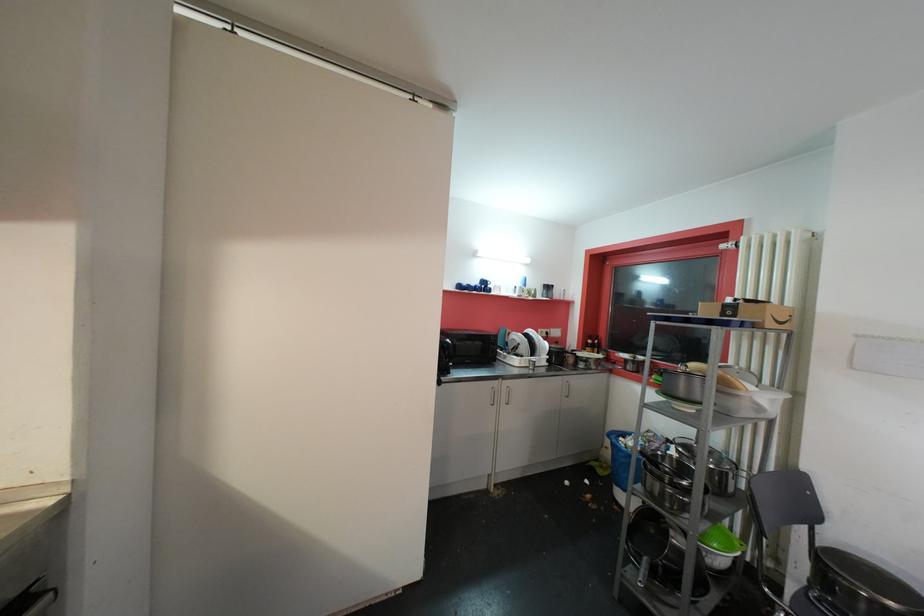
Which object does [750,313] point to?

It refers to a cardboard box.